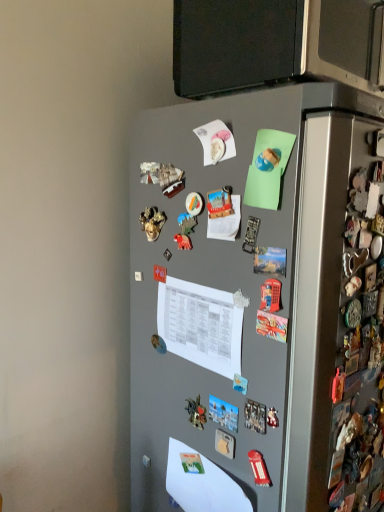
Question: Does point (347, 79) appear closer or farther from the camera than point (230, 294)?

Choices:
 (A) closer
 (B) farther

Answer: (A)

Question: Considering the relative positions of satin black microwave at upper center and white paper at center, positioned as the first paper in top-to-bottom order, in the image provided, is satin black microwave at upper center to the left or to the right of white paper at center, positioned as the first paper in top-to-bottom order,?

Choices:
 (A) right
 (B) left

Answer: (A)

Question: Based on their relative distances, which object is nearer to the satin black microwave at upper center?

Choices:
 (A) white paper at center, positioned as the first paper in top-to-bottom order
 (B) white paper at lower center, which is the 1th paper in bottom-to-top order
 (C) gray matte refrigerator at center

Answer: (C)

Question: Estimate the real-world distances between objects in this image. Which object is farther from the white paper at lower center, arranged as the 2th paper when viewed from the top?

Choices:
 (A) satin black microwave at upper center
 (B) white paper at center, positioned as the first paper in top-to-bottom order
 (C) gray matte refrigerator at center

Answer: (A)